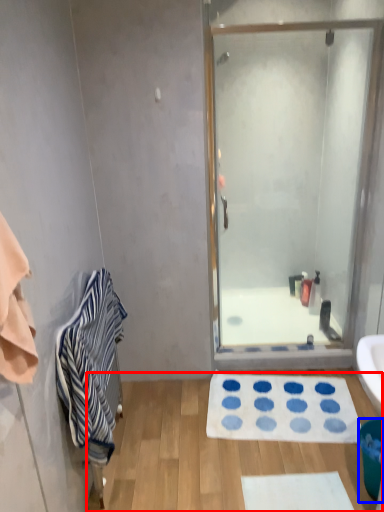
Question: Which point is closer to the camera, plain (highlighted by a red box) or trash bin/can (highlighted by a blue box)?

Choices:
 (A) plain
 (B) trash bin/can

Answer: (B)